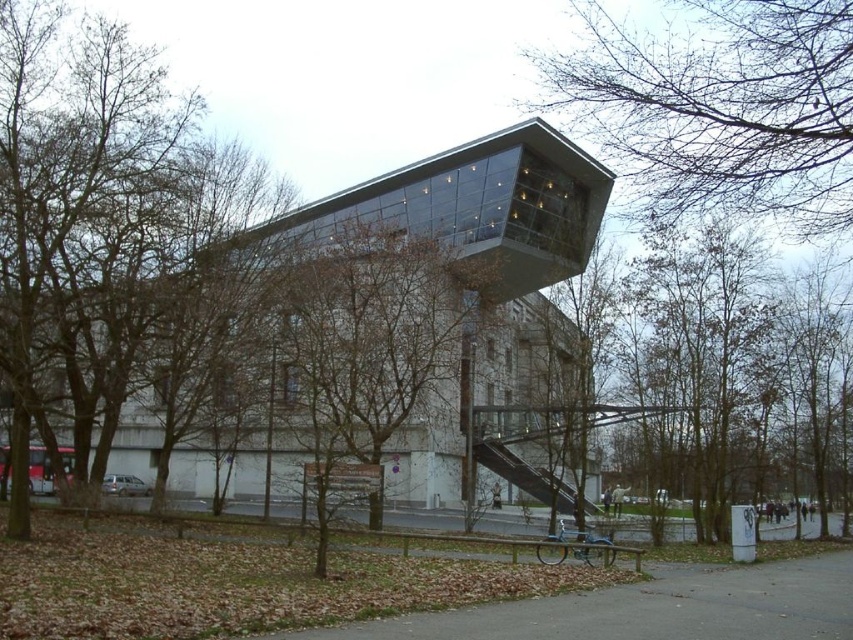
Question: Does bare branches at upper center appear over brown leafy tree at center?

Choices:
 (A) yes
 (B) no

Answer: (A)

Question: Which object appears closest to the camera in this image?

Choices:
 (A) bare branches at upper center
 (B) brown leafy tree at center

Answer: (A)

Question: Among these points, which one is nearest to the camera?

Choices:
 (A) (746, 3)
 (B) (314, 298)

Answer: (A)

Question: In this image, where is bare branches at upper center located relative to brown leafy tree at center?

Choices:
 (A) left
 (B) right

Answer: (B)

Question: Can you confirm if bare branches at upper center is bigger than brown leafy tree at center?

Choices:
 (A) no
 (B) yes

Answer: (A)